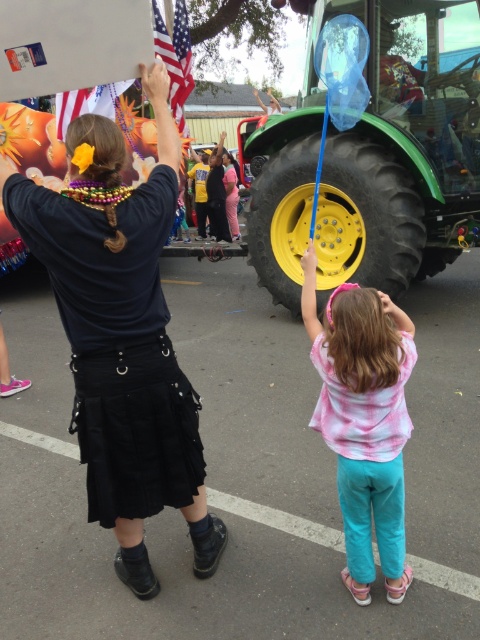
Question: Can you confirm if green rubber tractor at center is positioned to the left of american flag at upper left?

Choices:
 (A) yes
 (B) no

Answer: (B)

Question: Which point is closer to the camera taking this photo?

Choices:
 (A) (388, 458)
 (B) (103, 472)
 (C) (188, 42)
 (D) (370, 109)

Answer: (A)

Question: Is green rubber tractor at center thinner than pink tie-dye shirt at center?

Choices:
 (A) yes
 (B) no

Answer: (B)

Question: Is pink tie-dye shirt at center behind american flag at upper left?

Choices:
 (A) no
 (B) yes

Answer: (A)

Question: Which of the following is the closest to the observer?

Choices:
 (A) (399, 472)
 (B) (408, 131)

Answer: (A)

Question: Which object is farther from the camera taking this photo?

Choices:
 (A) american flag at upper left
 (B) pink tie-dye shirt at center
 (C) black leather skirt at center
 (D) green rubber tractor at center

Answer: (D)